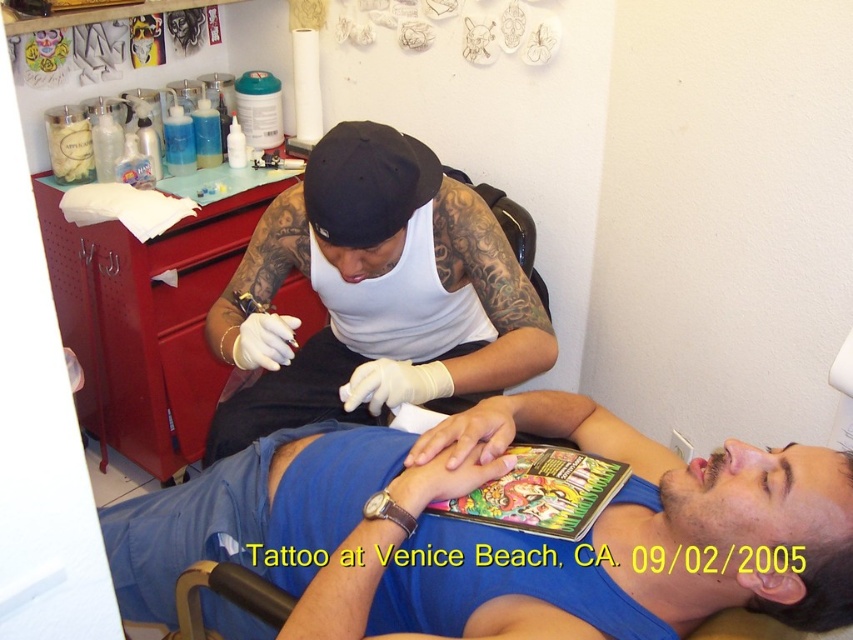
You are a customer in the tattoo studio and want to know if the blue fabric at lower center is visible under the white matte tank top at upper center. Can you confirm this?

Result: Yes, the blue fabric at lower center is positioned under the white matte tank top at upper center, so it is visible from below the tank top.